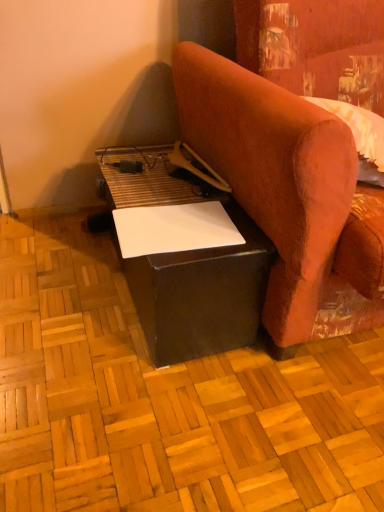
Question: Can you confirm if black matte table at lower center is taller than velvet-like orange armchair at right?

Choices:
 (A) yes
 (B) no

Answer: (B)

Question: Is black matte table at lower center oriented away from velvet-like orange armchair at right?

Choices:
 (A) no
 (B) yes

Answer: (A)

Question: Is black matte table at lower center not inside velvet-like orange armchair at right?

Choices:
 (A) no
 (B) yes

Answer: (B)

Question: Is the depth of black matte table at lower center less than that of velvet-like orange armchair at right?

Choices:
 (A) yes
 (B) no

Answer: (B)

Question: Is the position of black matte table at lower center more distant than that of velvet-like orange armchair at right?

Choices:
 (A) yes
 (B) no

Answer: (A)

Question: Are black matte table at lower center and velvet-like orange armchair at right making contact?

Choices:
 (A) yes
 (B) no

Answer: (B)

Question: Is white paper at lower center shorter than black matte table at lower center?

Choices:
 (A) yes
 (B) no

Answer: (A)

Question: Can you confirm if white paper at lower center is smaller than black matte table at lower center?

Choices:
 (A) yes
 (B) no

Answer: (A)

Question: Is white paper at lower center to the left of black matte table at lower center from the viewer's perspective?

Choices:
 (A) no
 (B) yes

Answer: (A)

Question: Does white paper at lower center have a greater height compared to black matte table at lower center?

Choices:
 (A) no
 (B) yes

Answer: (A)

Question: Can you confirm if white paper at lower center is wider than black matte table at lower center?

Choices:
 (A) no
 (B) yes

Answer: (A)

Question: Is white paper at lower center behind black matte table at lower center?

Choices:
 (A) yes
 (B) no

Answer: (A)

Question: Can you confirm if black matte table at lower center is wider than matte black plywood at center?

Choices:
 (A) yes
 (B) no

Answer: (B)